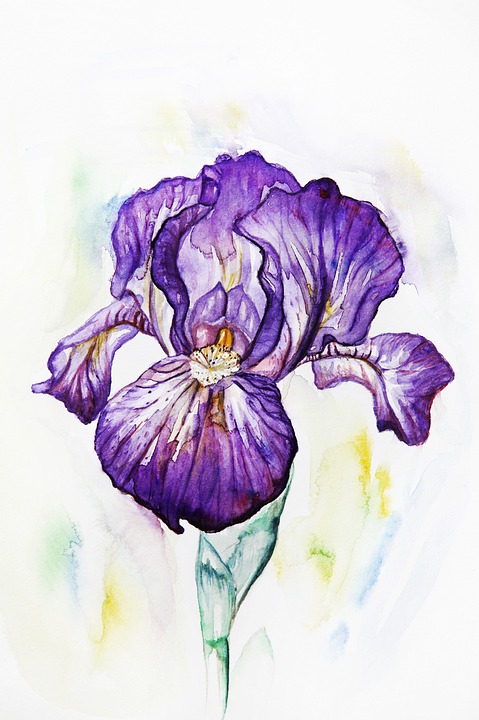
Where is `watercolor painting`? watercolor painting is located at coordinates (413, 692).